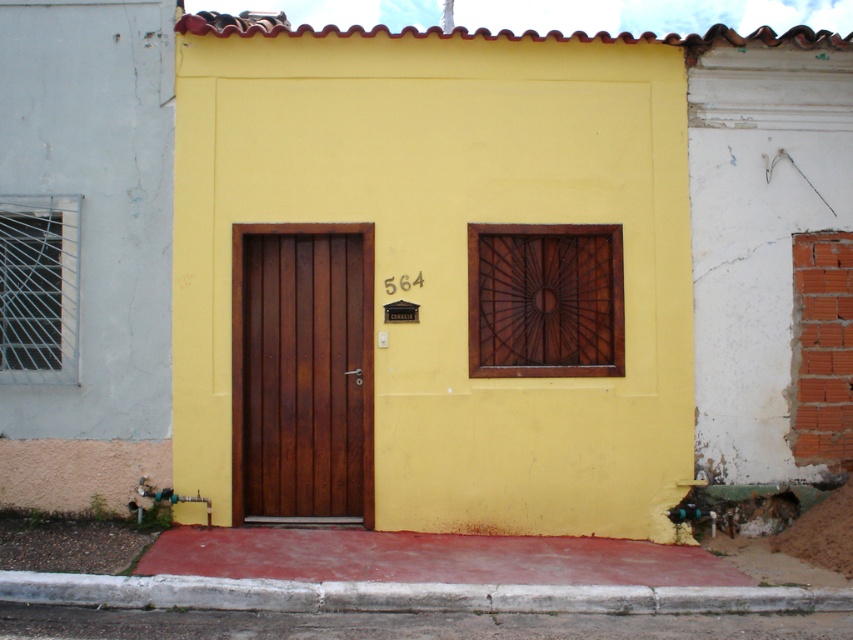
Does wooden door at center appear under concrete at lower center?

Incorrect, wooden door at center is not positioned below concrete at lower center.

Is point (283, 385) positioned behind point (537, 604)?

Yes, it is behind point (537, 604).

Identify the location of wooden door at center. Image resolution: width=853 pixels, height=640 pixels. (302, 371).